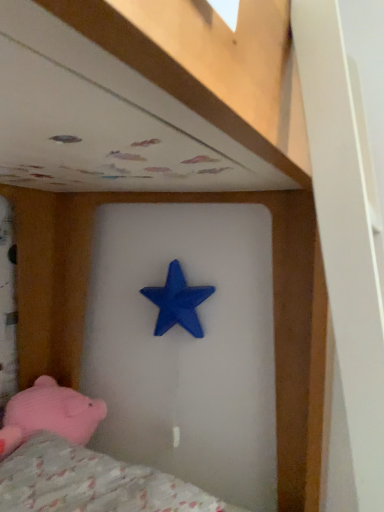
Question: Is blue matte star at center looking in the opposite direction of fluffy pink fabric at lower left?

Choices:
 (A) no
 (B) yes

Answer: (A)

Question: Can you confirm if blue matte star at center is smaller than fluffy pink fabric at lower left?

Choices:
 (A) yes
 (B) no

Answer: (A)

Question: Considering the relative sizes of blue matte star at center and fluffy pink fabric at lower left in the image provided, is blue matte star at center bigger than fluffy pink fabric at lower left?

Choices:
 (A) yes
 (B) no

Answer: (B)

Question: Are blue matte star at center and fluffy pink fabric at lower left far apart?

Choices:
 (A) yes
 (B) no

Answer: (B)

Question: Considering the relative positions of blue matte star at center and fluffy pink fabric at lower left in the image provided, is blue matte star at center to the left of fluffy pink fabric at lower left from the viewer's perspective?

Choices:
 (A) yes
 (B) no

Answer: (B)

Question: Considering the relative sizes of blue matte star at center and fluffy pink fabric at lower left in the image provided, is blue matte star at center shorter than fluffy pink fabric at lower left?

Choices:
 (A) no
 (B) yes

Answer: (A)

Question: Is blue matte star at center far from pink plush pig at lower left?

Choices:
 (A) no
 (B) yes

Answer: (A)

Question: Is blue matte star at center thinner than pink plush pig at lower left?

Choices:
 (A) no
 (B) yes

Answer: (B)

Question: From a real-world perspective, is blue matte star at center under pink plush pig at lower left?

Choices:
 (A) no
 (B) yes

Answer: (A)

Question: Considering the relative sizes of blue matte star at center and pink plush pig at lower left in the image provided, is blue matte star at center bigger than pink plush pig at lower left?

Choices:
 (A) yes
 (B) no

Answer: (B)

Question: Is blue matte star at center with pink plush pig at lower left?

Choices:
 (A) yes
 (B) no

Answer: (B)

Question: From the image's perspective, is blue matte star at center located above pink plush pig at lower left?

Choices:
 (A) no
 (B) yes

Answer: (B)

Question: From a real-world perspective, is pink plush pig at lower left over fluffy pink fabric at lower left?

Choices:
 (A) no
 (B) yes

Answer: (B)